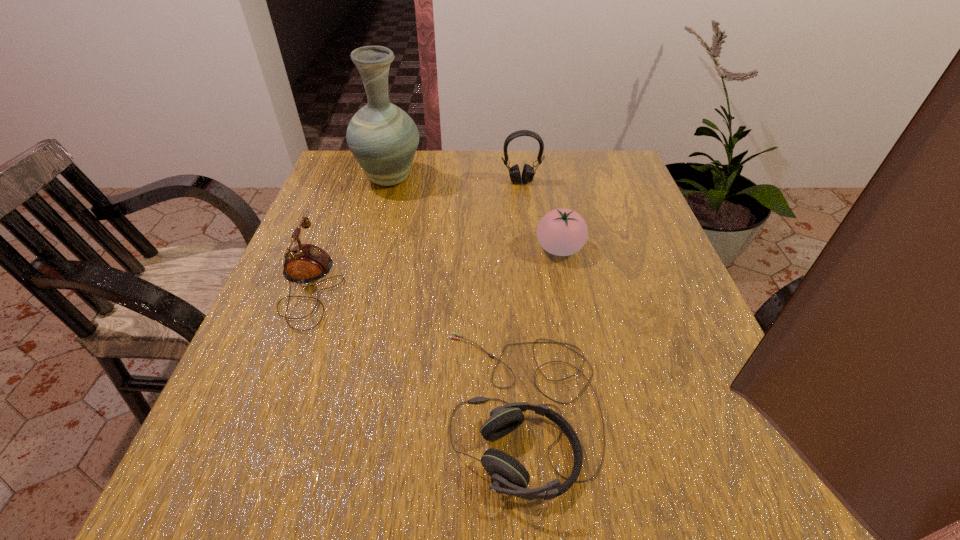
Find the location of a particular element. The image size is (960, 540). vacant space that satisfies the following two spatial constraints: 1. on the front-facing side of the taller headset; 2. on the outer surface of the nearest object is located at coordinates (550, 408).

Identify the location of free point that satisfies the following two spatial constraints: 1. on the front-facing side of the taller headset; 2. on the outer surface of the nearest object. This screenshot has height=540, width=960. (550, 408).

This screenshot has width=960, height=540. Find the location of `free space that satisfies the following two spatial constraints: 1. on the front side of the tomato; 2. on the outer surface of the shortest object`. free space that satisfies the following two spatial constraints: 1. on the front side of the tomato; 2. on the outer surface of the shortest object is located at coordinates (591, 408).

You are a GUI agent. You are given a task and a screenshot of the screen. Output one action in this format:
    pyautogui.click(x=<x>, y=<y>)
    Task: Click on the free space in the image that satisfies the following two spatial constraints: 1. on the front-facing side of the taller headset; 2. on the rotary dial of the telephone
    Image resolution: width=960 pixels, height=540 pixels.
    Given the screenshot: What is the action you would take?
    pyautogui.click(x=535, y=286)